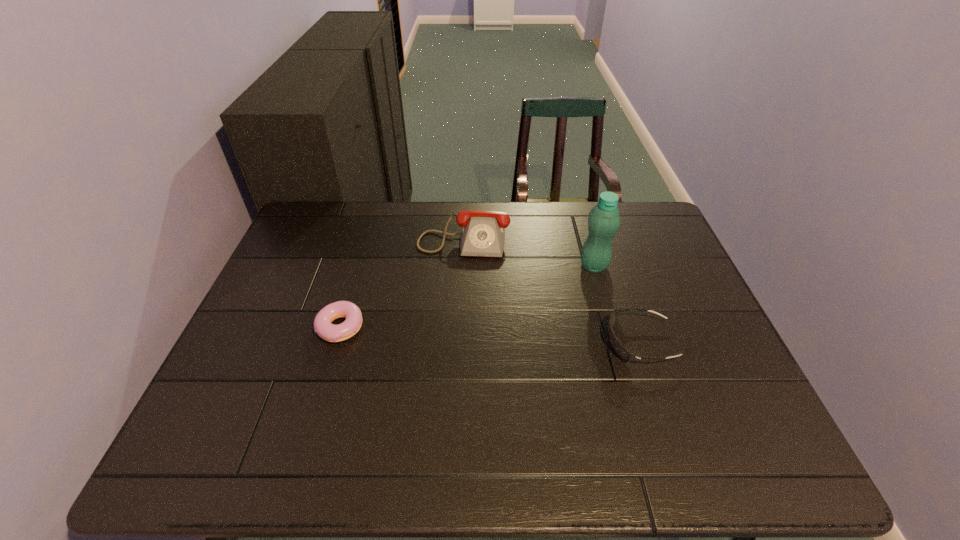
At what (x,y) coordinates should I click in order to perform the action: click on free space at the left edge of the desktop. Please return your answer as a coordinate pair (x, y). Looking at the image, I should click on pyautogui.click(x=295, y=254).

At what (x,y) coordinates should I click in order to perform the action: click on vacant space at the right edge of the desktop. Please return your answer as a coordinate pair (x, y). This screenshot has width=960, height=540. Looking at the image, I should click on (677, 373).

At what (x,y) coordinates should I click in order to perform the action: click on vacant space at the far left corner of the desktop. Please return your answer as a coordinate pair (x, y). Looking at the image, I should click on (x=317, y=212).

Where is `blank space at the near left corner of the desktop`? The image size is (960, 540). blank space at the near left corner of the desktop is located at coordinates (211, 395).

This screenshot has height=540, width=960. Find the location of `free space at the near right corner of the desktop`. free space at the near right corner of the desktop is located at coordinates (732, 399).

The height and width of the screenshot is (540, 960). What are the coordinates of `free spot between the shortest object and the water bottle` in the screenshot? It's located at (467, 296).

Where is `free point between the tallest object and the goggles`? The image size is (960, 540). free point between the tallest object and the goggles is located at coordinates (616, 304).

Locate an element on the screen. Image resolution: width=960 pixels, height=540 pixels. vacant area between the doughnut and the water bottle is located at coordinates (467, 296).

The image size is (960, 540). What are the coordinates of `vacant area between the leftmost object and the water bottle` in the screenshot? It's located at (467, 296).

What are the coordinates of `free space between the leftmost object and the goggles` in the screenshot? It's located at (490, 335).